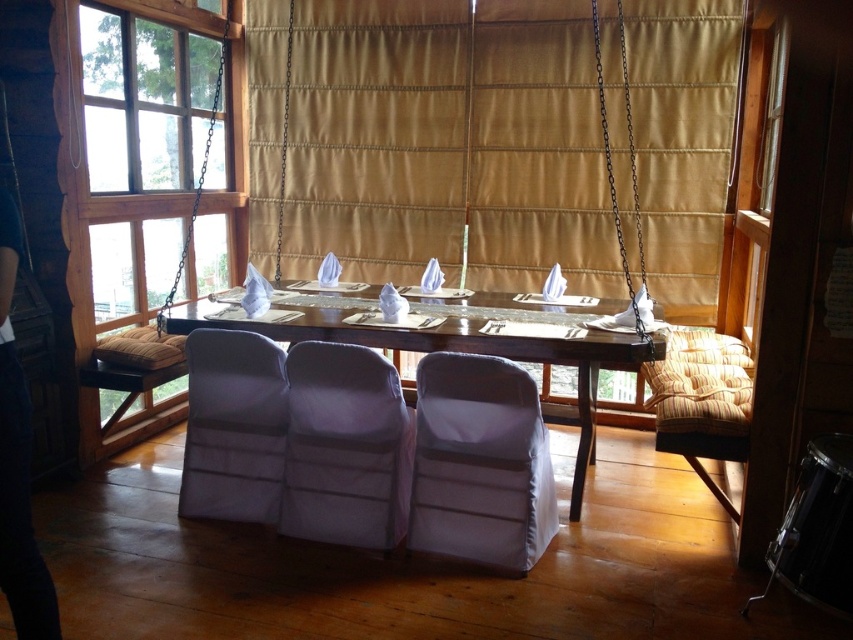
You are a guest entering the dining area and want to sit in the matte white armchair at center. To reach it, you need to walk through the space between the gold fabric curtain at center and the dining table. Is there enough space for you to pass through comfortably?

The matte white armchair at center is in front of the gold fabric curtain at center, so there is space between them for you to walk through comfortably.

You are planning to hang a large painting that takes up a lot of space. Based on the scene, which object between the transparent glass window at upper left and the wooden table at center would you choose to place the painting near, considering their space availability?

The wooden table at center occupies more space than the transparent glass window at upper left, so you should place the painting near the wooden table at center as it has more space available.

You are planning to seat a guest at the dining table. The guest prefers sitting as close as possible to the entrance door located at the far left corner of the room. Which object should they choose between the white fabric chair at center and the cushioned benches with striped upholstery?

The white fabric chair at center is located at point (480,464), which is closer to the entrance door at the far left corner compared to the cushioned benches with striped upholstery. Therefore, the guest should choose the white fabric chair at center.